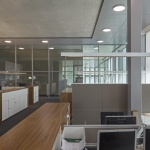
Image resolution: width=150 pixels, height=150 pixels. Identify the location of gray desk divider. (88, 96).